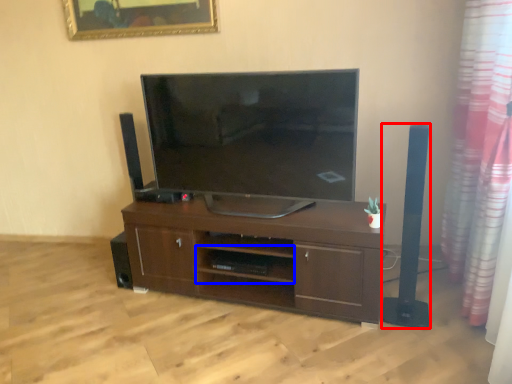
Question: Among these objects, which one is farthest to the camera, speaker (highlighted by a red box) or shelf (highlighted by a blue box)?

Choices:
 (A) speaker
 (B) shelf

Answer: (B)